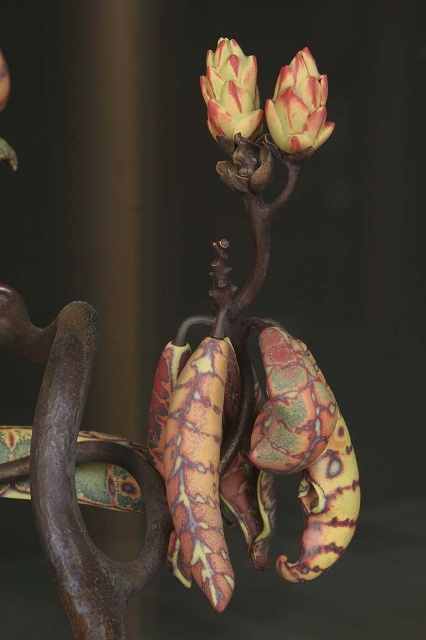
Between point (270, 109) and point (218, 116), which one is positioned in front?

Point (270, 109)

Is matte pinkish-red flower at upper center above matte pinkish-green flower at upper center?

No, matte pinkish-red flower at upper center is not above matte pinkish-green flower at upper center.

At what (x,y) coordinates should I click in order to perform the action: click on matte pinkish-red flower at upper center. Please return your answer as a coordinate pair (x, y). The width and height of the screenshot is (426, 640). Looking at the image, I should click on (299, 106).

Locate an element on the screen. This screenshot has width=426, height=640. matte pinkish-red flower at upper center is located at coordinates (299, 106).